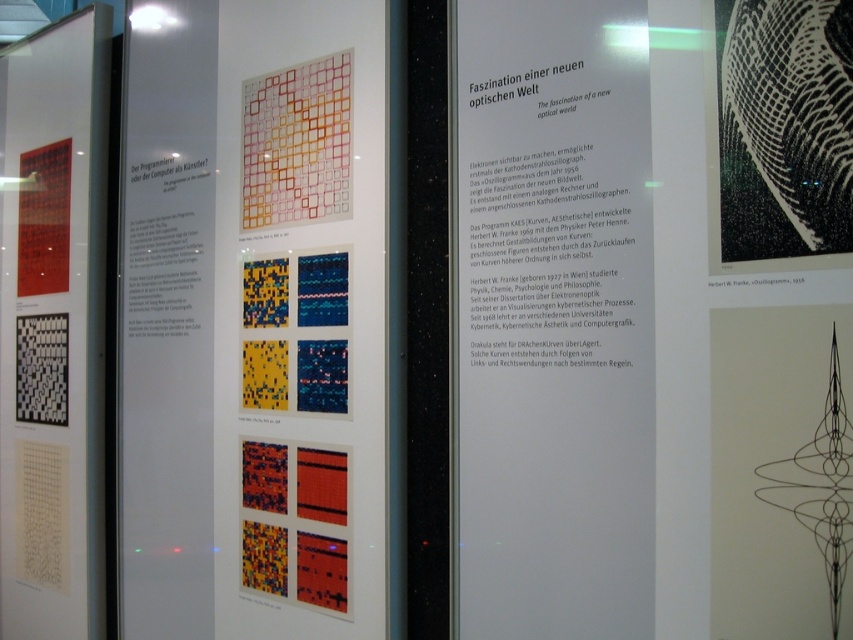
Between white paper at center and multicolored grid at center, which one is positioned higher?

multicolored grid at center

Can you confirm if white paper at center is shorter than multicolored grid at center?

No.

The image size is (853, 640). What are the coordinates of `white paper at center` in the screenshot? It's located at (550, 321).

Who is more distant from viewer, (39, 131) or (734, 211)?

Positioned behind is point (39, 131).

Looking at this image, does matte black poster at left appear over black line drawing at upper right?

Actually, matte black poster at left is below black line drawing at upper right.

Does point (50, 262) come closer to viewer compared to point (822, 99)?

No, (50, 262) is behind (822, 99).

This screenshot has width=853, height=640. In order to click on matte black poster at left in this screenshot , I will do `click(51, 326)`.

Does matte paper poster at center have a larger size compared to white paper at center?

Indeed, matte paper poster at center has a larger size compared to white paper at center.

Does matte paper poster at center appear under white paper at center?

Yes, matte paper poster at center is below white paper at center.

Does point (340, 241) come closer to viewer compared to point (556, 560)?

No, (340, 241) is behind (556, 560).

Find the location of a particular element. This screenshot has width=853, height=640. matte paper poster at center is located at coordinates (254, 321).